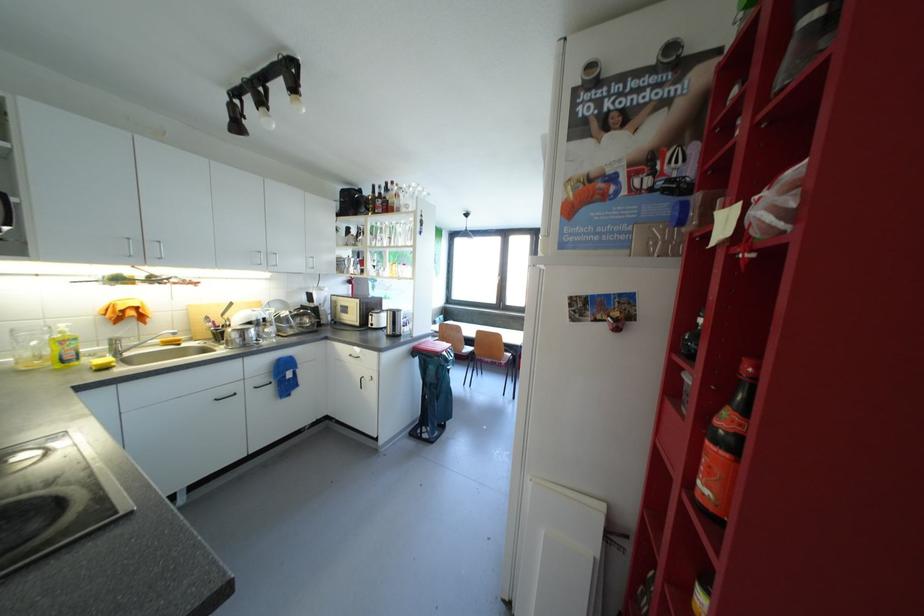
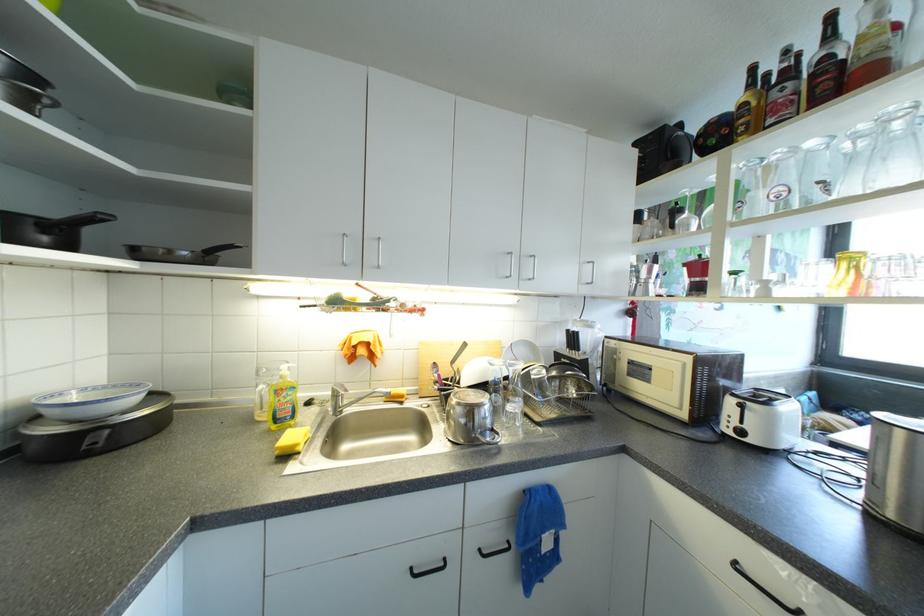
Where in the second image is the point corresponding to point 393,225 from the first image?

(818, 146)